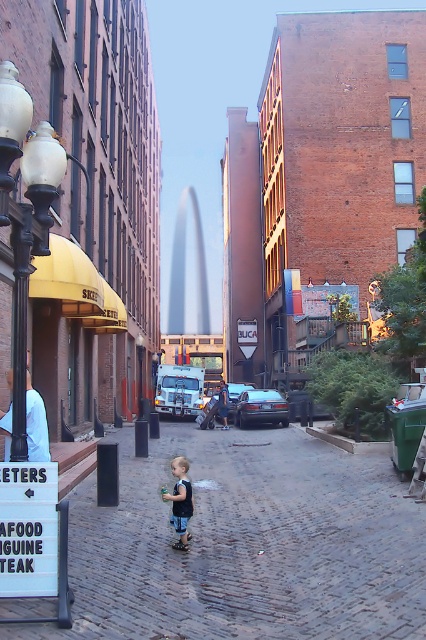
Question: Can you confirm if cobblestone pavement at center is smaller than black glass lamp post at left?

Choices:
 (A) no
 (B) yes

Answer: (A)

Question: Does cobblestone pavement at center appear on the left side of black glass lamp post at left?

Choices:
 (A) yes
 (B) no

Answer: (B)

Question: Observing the image, what is the correct spatial positioning of black glass lamp post at left in reference to white plastic sign at lower left?

Choices:
 (A) below
 (B) above

Answer: (B)

Question: Among these objects, which one is farthest from the camera?

Choices:
 (A) white plastic sign at lower left
 (B) cobblestone pavement at center

Answer: (A)

Question: Which is nearer to the black glass lamp post at left?

Choices:
 (A) white plastic sign at lower left
 (B) cobblestone pavement at center

Answer: (A)

Question: Which object is the closest to the black glass lamp post at left?

Choices:
 (A) cobblestone pavement at center
 (B) white plastic sign at lower left

Answer: (B)